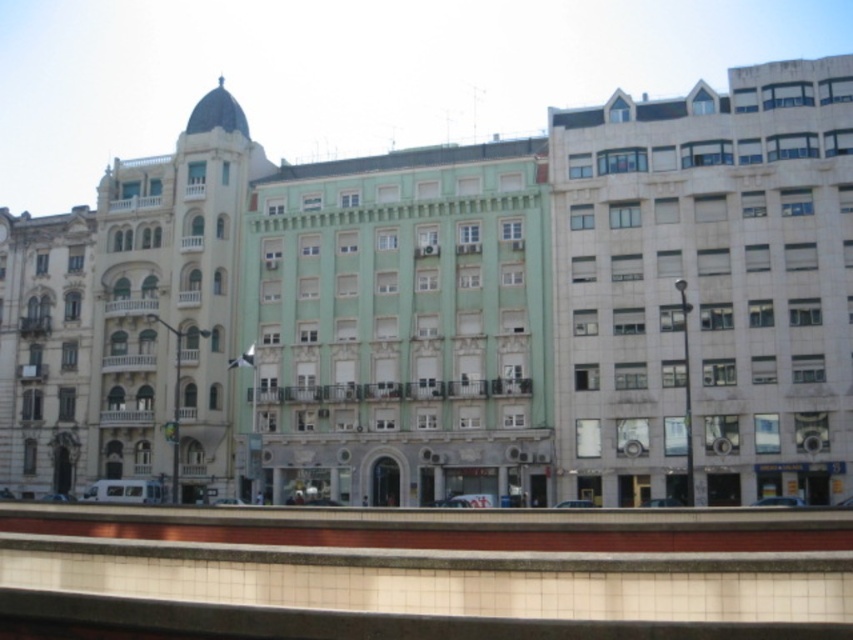
Based on the scene description, what are the coordinates of the white marble building at right?

The white marble building at right is located at coordinates point [706,289].

You are an urban planner evaluating building widths for a renovation project. You observe the green stone building at center and the matte gray building at left. Which building has a greater width according to the scene?

The green stone building at center has a greater width than the matte gray building at left as stated in the description.

From the picture: You are an architect planning to place a new sculpture between the white marble building at right and the beige stone building at left. Which building should the sculpture be closer to if you want it to appear proportionally balanced with both structures?

The sculpture should be closer to the white marble building at right because it is smaller than the beige stone building at left, creating a balanced visual weight.